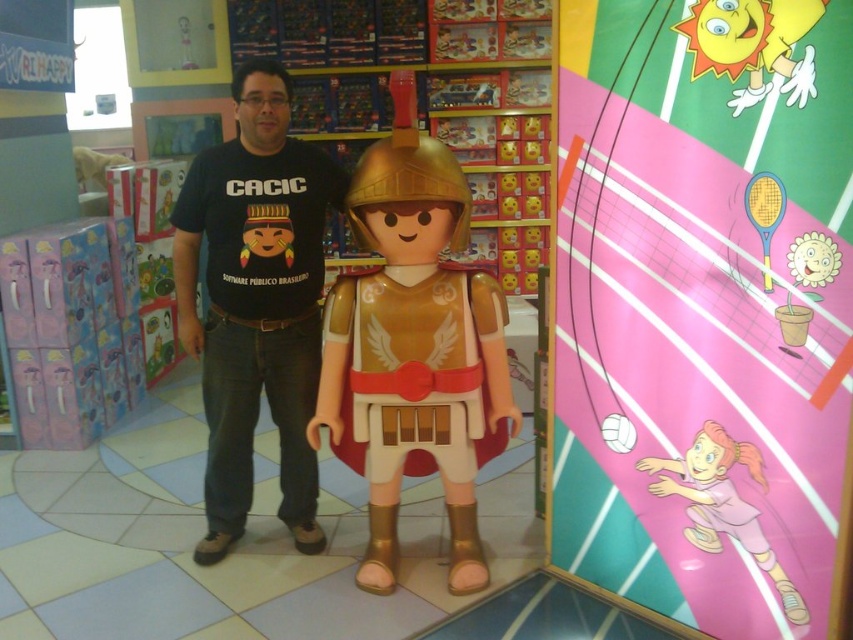
You are a customer in a toy store holding a measuring tape. You want to know if the matte gold armor at center can fit into a storage box that is exactly the same width as the pink matte volleyball at center. Can it fit?

The matte gold armor at center might be wider than the pink matte volleyball at center, so it may not fit into the storage box designed for the volleyball.